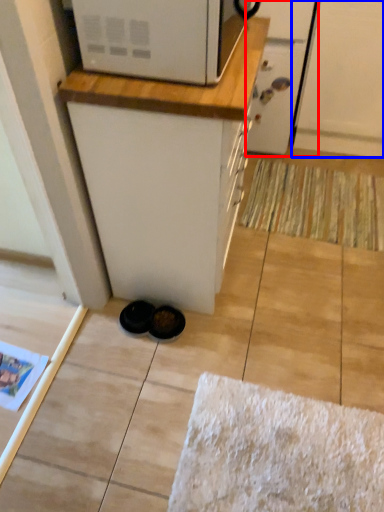
Question: Which point is closer to the camera, screen door (highlighted by a red box) or screen door (highlighted by a blue box)?

Choices:
 (A) screen door
 (B) screen door

Answer: (B)